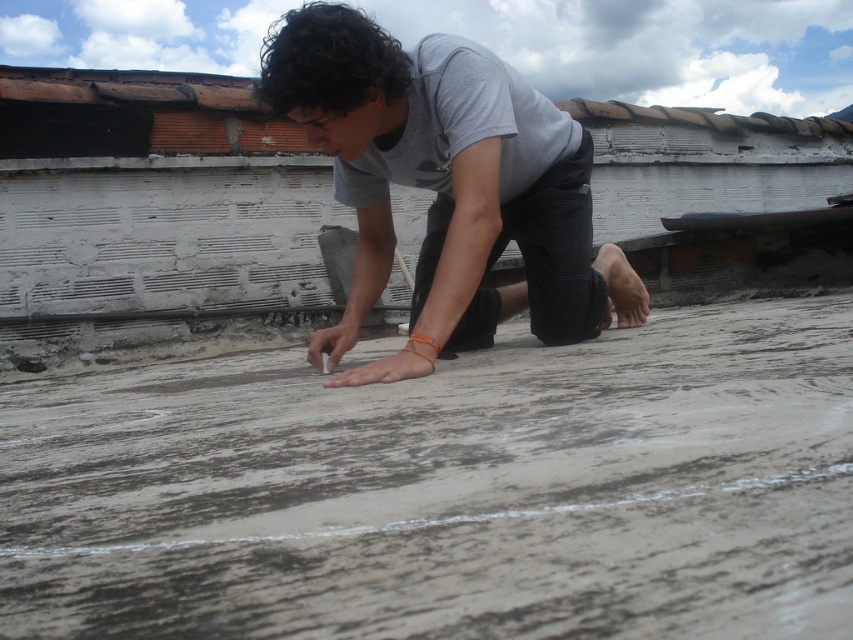
Question: Is gray concrete at center to the right of gray matte shirt at center from the viewer's perspective?

Choices:
 (A) no
 (B) yes

Answer: (B)

Question: Which object is closer to the camera taking this photo?

Choices:
 (A) gray matte shirt at center
 (B) gray concrete at center

Answer: (B)

Question: Can you confirm if gray concrete at center is wider than gray matte shirt at center?

Choices:
 (A) no
 (B) yes

Answer: (B)

Question: Which point is closer to the camera?

Choices:
 (A) (215, 561)
 (B) (601, 321)

Answer: (A)

Question: Which object appears farthest from the camera in this image?

Choices:
 (A) gray matte shirt at center
 (B) gray concrete at center

Answer: (A)

Question: Can you confirm if gray concrete at center is positioned to the left of gray matte shirt at center?

Choices:
 (A) no
 (B) yes

Answer: (A)